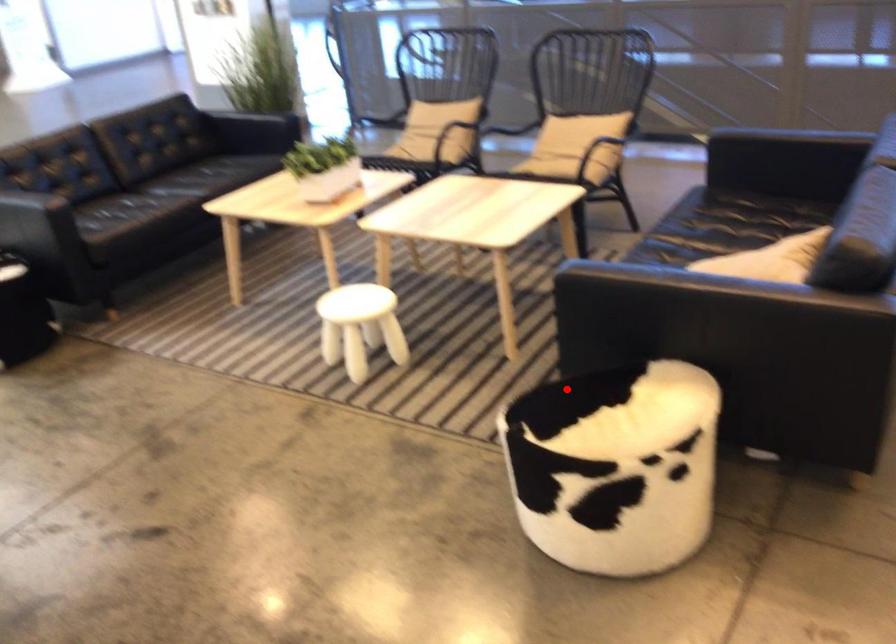
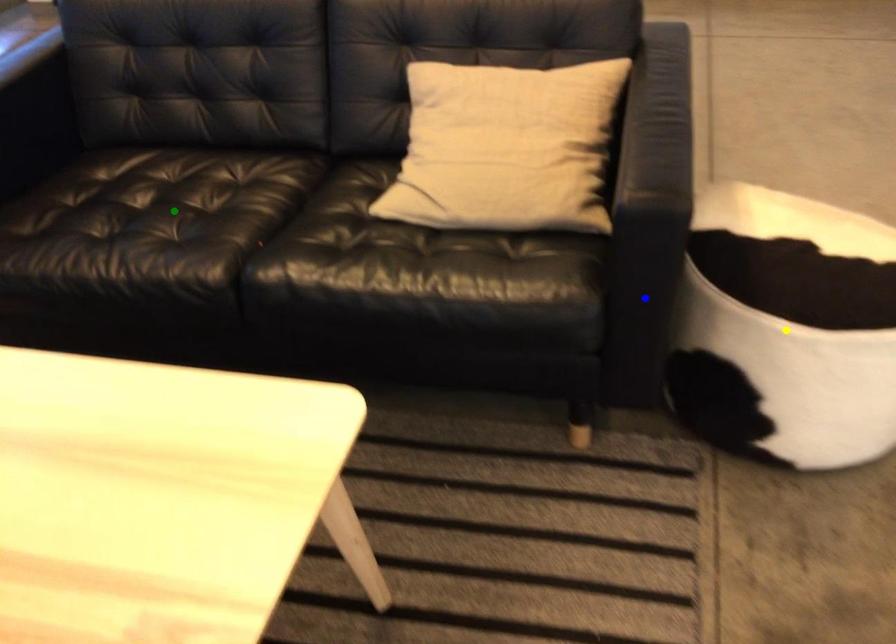
Question: I am providing you with two images of the same scene from different viewpoints. A red point is marked on the first image. You are given multiple points on the second image. Which point in image 2 is actually the same real-world point as the red point in image 1?

Choices:
 (A) yellow point
 (B) blue point
 (C) green point

Answer: (A)